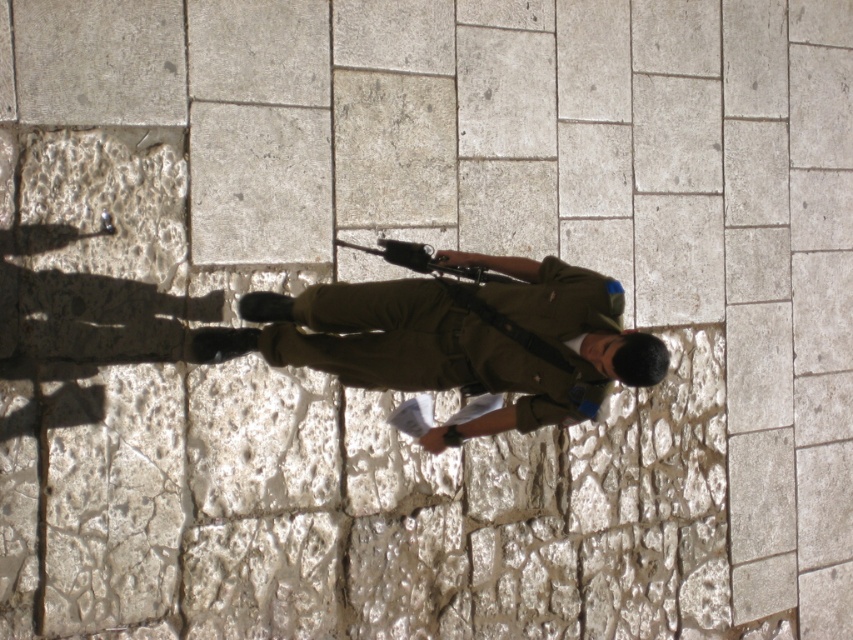
Can you confirm if olive green uniform at center is shorter than polished metal rifle at center?

Incorrect, olive green uniform at center's height does not fall short of polished metal rifle at center's.

Can you confirm if olive green uniform at center is smaller than polished metal rifle at center?

Incorrect, olive green uniform at center is not smaller in size than polished metal rifle at center.

What do you see at coordinates (459, 339) in the screenshot? I see `olive green uniform at center` at bounding box center [459, 339].

Find the location of a particular element. The image size is (853, 640). olive green uniform at center is located at coordinates (459, 339).